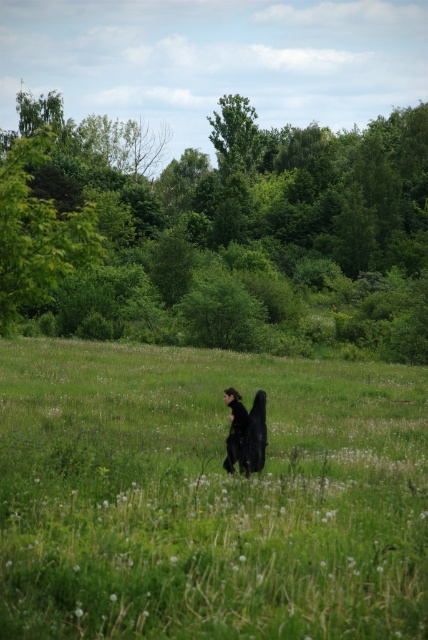
You are standing at the point with coordinates point [9,195] and want to move towards the point with coordinates point [256,552]. Which direction should you move?

You should move towards the point [256,552] because it is closer to the camera than the point [9,195].